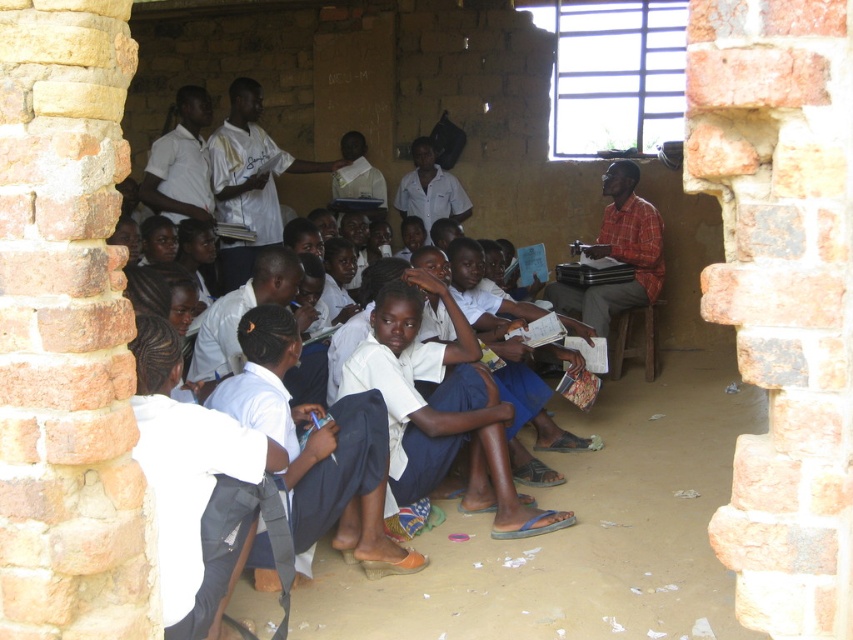
You are a student in the classroom and want to find the white shirt at center. According to the coordinates provided, where exactly should you look in the image?

The white shirt at center is located at point coordinates 0.283 on the x axis and 0.292 on the y axis.